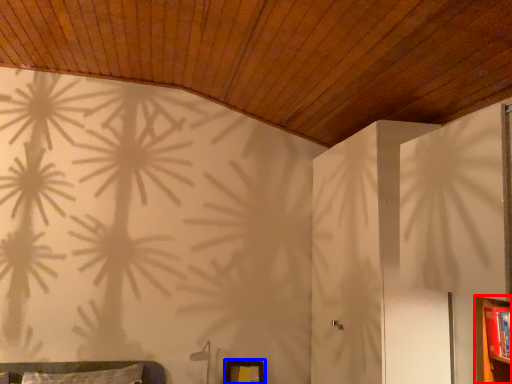
Question: Which object is closer to the camera taking this photo, dresser (highlighted by a red box) or picture frame (highlighted by a blue box)?

Choices:
 (A) dresser
 (B) picture frame

Answer: (A)